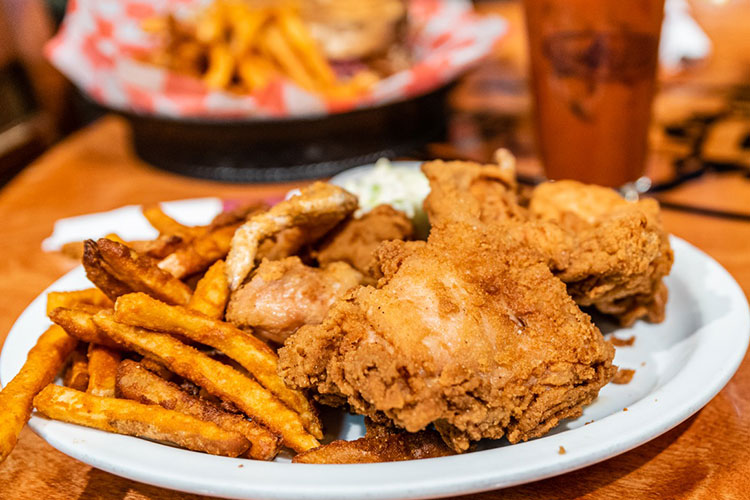
Identify the location of cup. This screenshot has height=500, width=750. (584, 94).